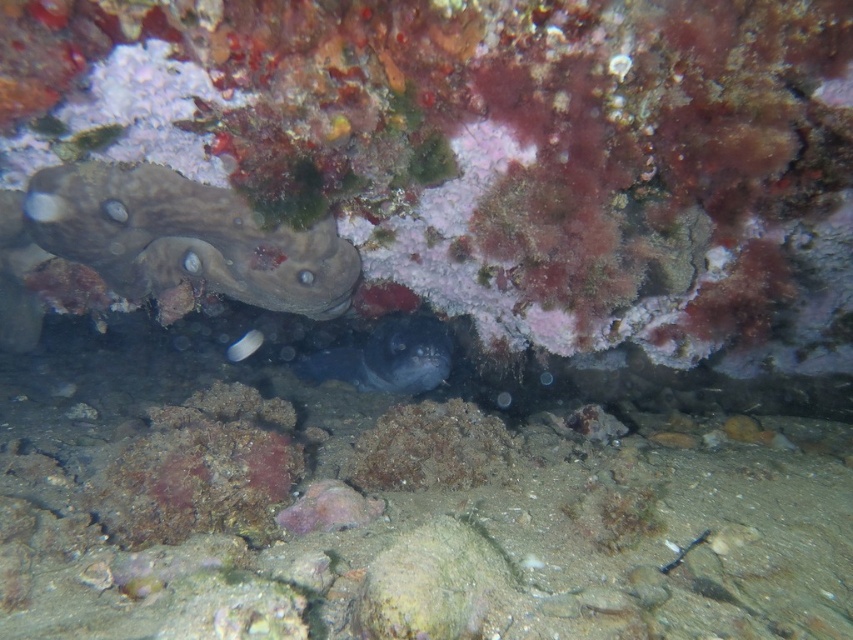
Question: Which object is farther from the camera taking this photo?

Choices:
 (A) smooth gray rock at left
 (B) smooth dark gray fish at center

Answer: (B)

Question: Where is smooth gray rock at left located in relation to smooth dark gray fish at center in the image?

Choices:
 (A) above
 (B) below

Answer: (A)

Question: Which point is closer to the camera?

Choices:
 (A) (386, 381)
 (B) (351, 288)

Answer: (B)

Question: Is smooth gray rock at left above smooth dark gray fish at center?

Choices:
 (A) no
 (B) yes

Answer: (B)

Question: Is smooth gray rock at left positioned at the back of smooth dark gray fish at center?

Choices:
 (A) yes
 (B) no

Answer: (B)